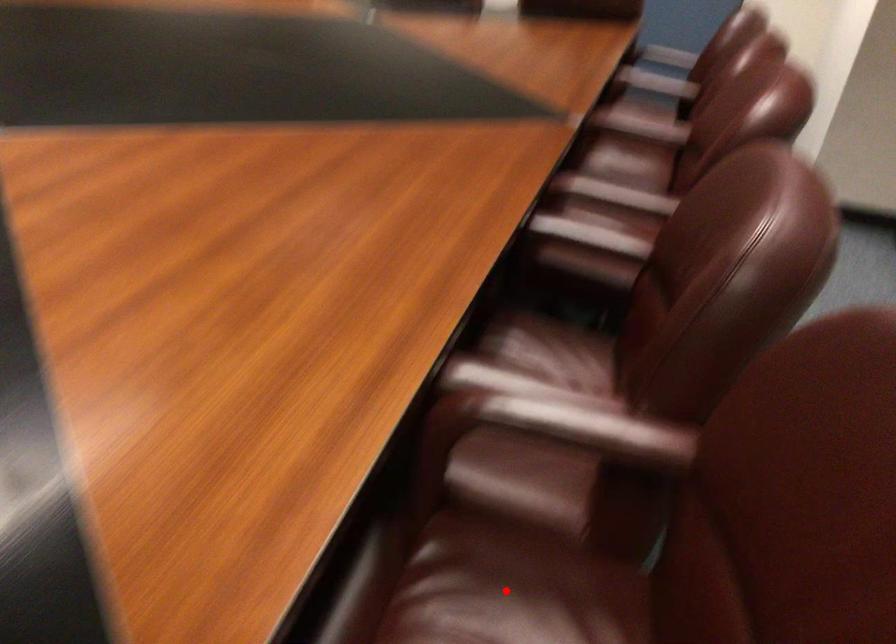
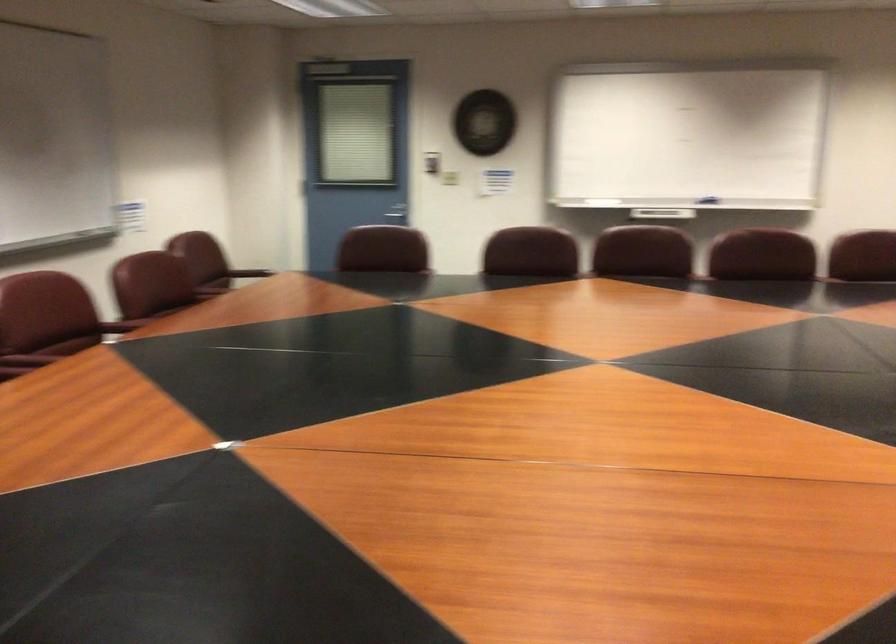
Question: I am providing you with two images of the same scene from different viewpoints. A red point is marked on the first image. At the location where the point appears in image 1, is it still visible in image 2?

Choices:
 (A) Yes
 (B) No

Answer: (B)